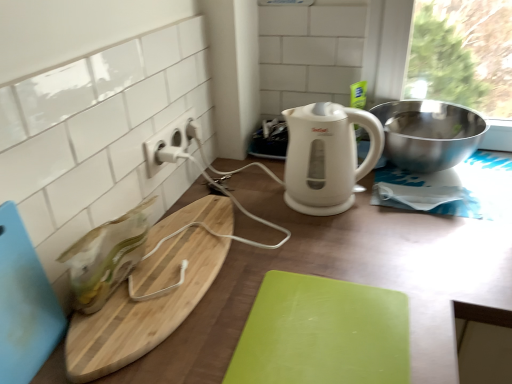
Question: Which is correct: green matte cutting board at center, marked as the first cutting board in a right-to-left arrangement, is inside polished stainless steel bowl at upper right, or outside of it?

Choices:
 (A) outside
 (B) inside

Answer: (A)

Question: In terms of width, does green matte cutting board at center, arranged as the 3th cutting board when viewed from the left, look wider or thinner when compared to polished stainless steel bowl at upper right?

Choices:
 (A) thin
 (B) wide

Answer: (A)

Question: Which of these objects is positioned closest to the blue plastic cutting board at lower left, the third cutting board positioned from the right?

Choices:
 (A) natural wood cutting board at left, the second cutting board when ordered from right to left
 (B) polished stainless steel bowl at upper right
 (C) green matte cutting board at center, arranged as the 3th cutting board when viewed from the left
 (D) white plastic electric outlet at upper center
 (E) wooden cutting board at center

Answer: (A)

Question: Considering the real-world distances, which object is farthest from the polished stainless steel bowl at upper right?

Choices:
 (A) white plastic electric outlet at upper center
 (B) blue plastic cutting board at lower left, the third cutting board positioned from the right
 (C) natural wood cutting board at left, which is the 2th cutting board from left to right
 (D) green matte cutting board at center, arranged as the 3th cutting board when viewed from the left
 (E) white glossy electric kettle at center

Answer: (B)